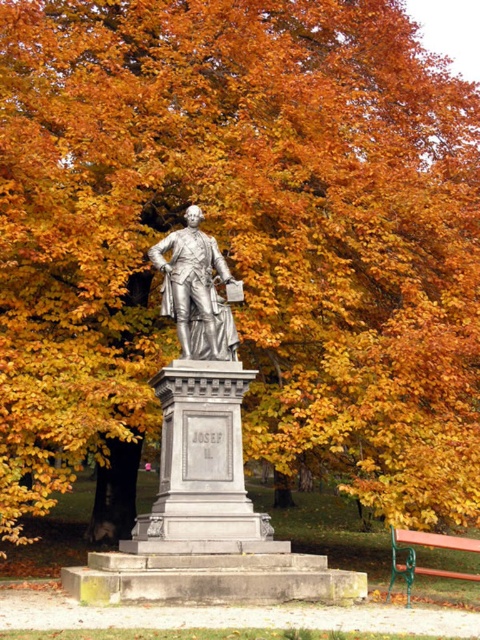
Question: Is polished bronze statue at center to the right of polished silver statue at center from the viewer's perspective?

Choices:
 (A) yes
 (B) no

Answer: (B)

Question: Does polished bronze statue at center appear over wooden park bench at lower right?

Choices:
 (A) no
 (B) yes

Answer: (B)

Question: Which of the following is the farthest from the observer?

Choices:
 (A) wooden park bench at lower right
 (B) polished silver statue at center
 (C) polished bronze statue at center

Answer: (B)

Question: Which point appears closest to the camera in this image?

Choices:
 (A) (417, 534)
 (B) (194, 266)
 (C) (193, 221)

Answer: (A)

Question: Which object is the farthest from the polished silver statue at center?

Choices:
 (A) polished bronze statue at center
 (B) wooden park bench at lower right

Answer: (B)

Question: Is polished bronze statue at center further to camera compared to wooden park bench at lower right?

Choices:
 (A) no
 (B) yes

Answer: (A)